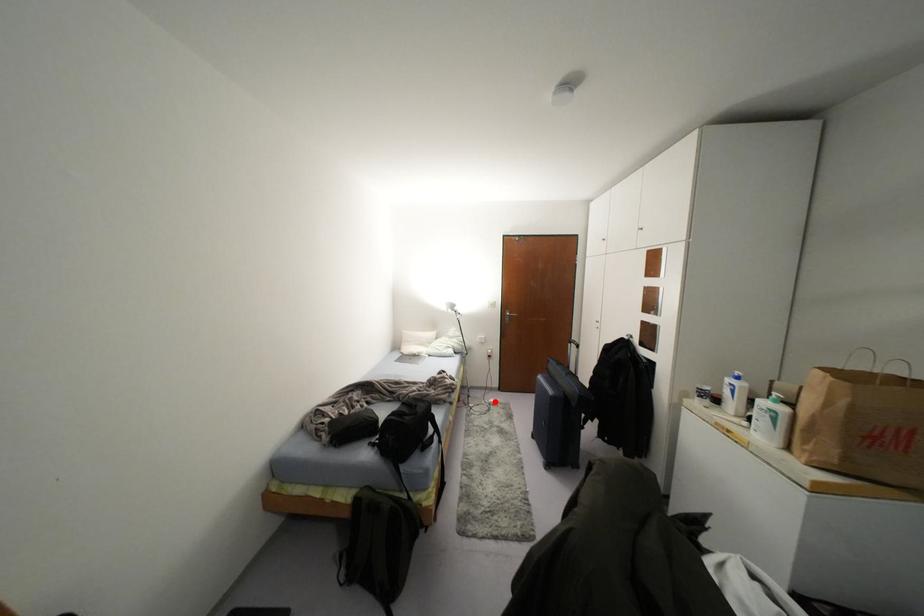
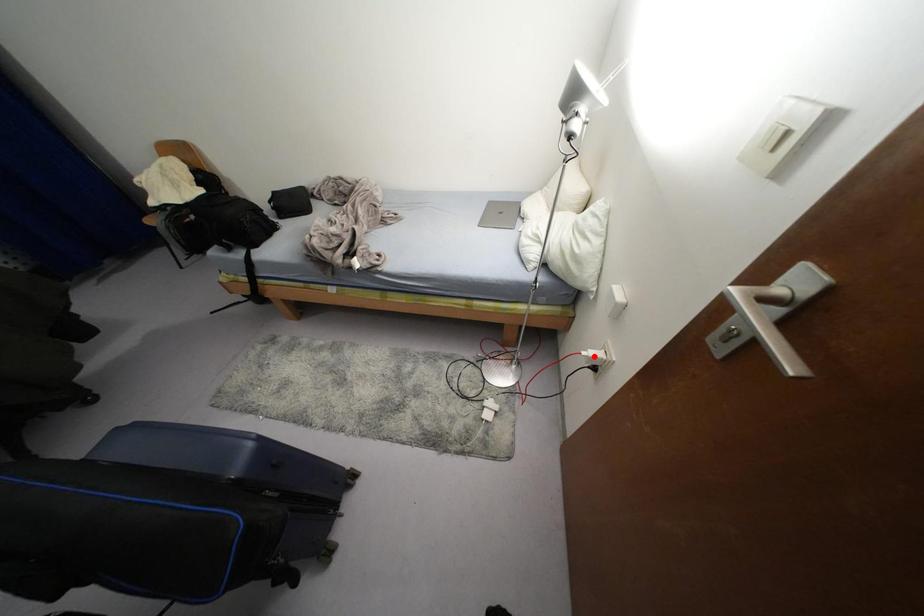
I am providing you with two images of the same scene from different viewpoints. A red point is marked on the first image and another point is marked on the second image. Does the point marked in image1 correspond to the same location as the one in image2?

No